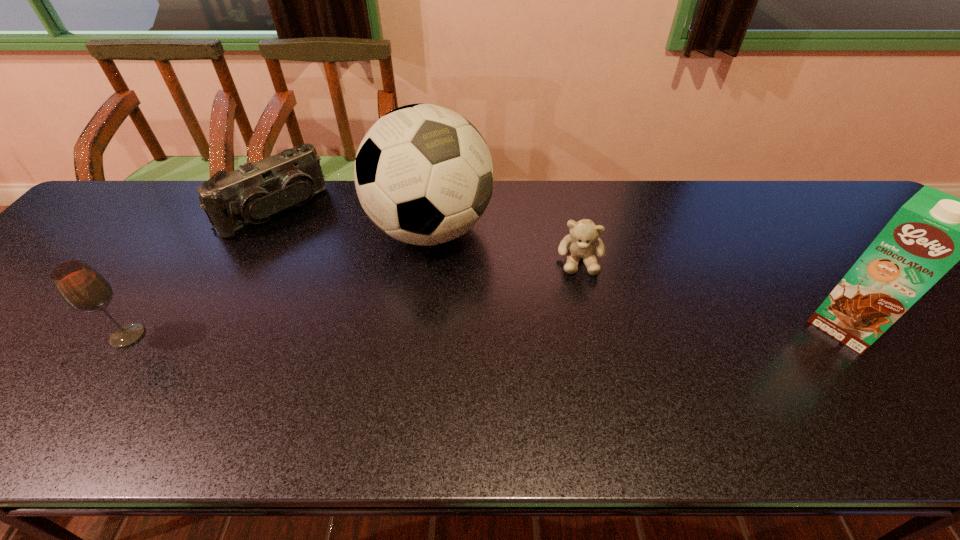
You are a GUI agent. You are given a task and a screenshot of the screen. Output one action in this format:
    pyautogui.click(x=<x>, y=<y>)
    Task: Click on the third tallest object
    Image resolution: width=960 pixels, height=540 pixels.
    Given the screenshot: What is the action you would take?
    pyautogui.click(x=80, y=286)

Locate an element on the screen. Image resolution: width=960 pixels, height=540 pixels. carton is located at coordinates (932, 231).

Find the location of `the third object from right to left`. the third object from right to left is located at coordinates (423, 173).

The image size is (960, 540). In order to click on camcorder in this screenshot , I will do `click(254, 193)`.

Locate an element on the screen. The image size is (960, 540). the shortest object is located at coordinates (582, 242).

Where is `teddy bear`? The image size is (960, 540). teddy bear is located at coordinates (582, 242).

Locate an element on the screen. The width and height of the screenshot is (960, 540). vacant region located on the right of the glass drink container is located at coordinates (176, 336).

You are a GUI agent. You are given a task and a screenshot of the screen. Output one action in this format:
    pyautogui.click(x=<x>, y=<y>)
    Task: Click on the vacant space situated on the back of the carton
    This screenshot has height=540, width=960.
    Given the screenshot: What is the action you would take?
    pyautogui.click(x=813, y=281)

This screenshot has width=960, height=540. Find the location of `vacant area situated on the main logo of the soccer ball`. vacant area situated on the main logo of the soccer ball is located at coordinates (487, 297).

This screenshot has height=540, width=960. What are the coordinates of `free space located 0.190m on the main logo of the soccer ball` in the screenshot? It's located at (503, 316).